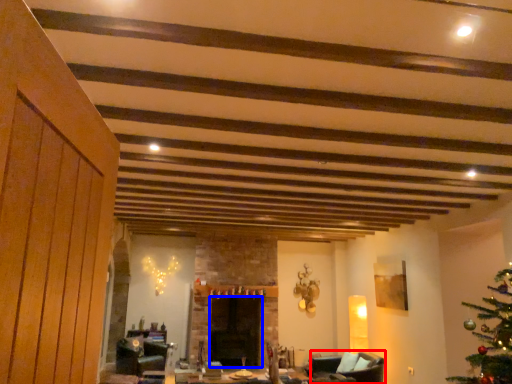
Question: Which object is further to the camera taking this photo, armchair (highlighted by a red box) or fireplace (highlighted by a blue box)?

Choices:
 (A) armchair
 (B) fireplace

Answer: (B)